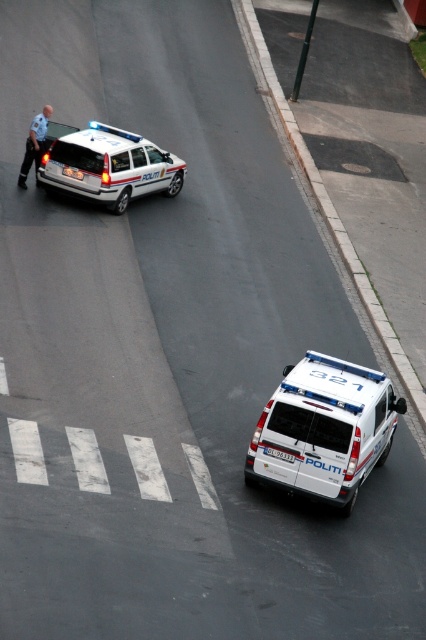
Question: Is white matte van at lower right thinner than white glossy van at upper left?

Choices:
 (A) yes
 (B) no

Answer: (A)

Question: Which object is farther from the camera taking this photo?

Choices:
 (A) light blue uniform at left
 (B) white matte van at lower right
 (C) white glossy van at upper left
 (D) white plastic license plate at center

Answer: (A)

Question: Estimate the real-world distances between objects in this image. Which object is closer to the white plastic license plate at center?

Choices:
 (A) white matte van at lower right
 (B) white glossy van at upper left

Answer: (A)

Question: Which point is closer to the camera taking this photo?

Choices:
 (A) (265, 449)
 (B) (92, 179)
 (C) (273, 474)

Answer: (A)

Question: Can you confirm if white glossy van at upper left is bigger than white plastic license plate at center?

Choices:
 (A) yes
 (B) no

Answer: (A)

Question: Is white glossy van at upper left positioned before white plastic license plate at center?

Choices:
 (A) yes
 (B) no

Answer: (B)